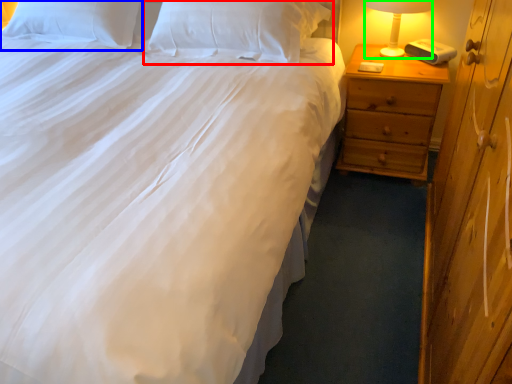
Question: Which object is the closest to the pillow (highlighted by a red box)? Choose among these: pillow (highlighted by a blue box) or bedside lamp (highlighted by a green box).

Choices:
 (A) pillow
 (B) bedside lamp

Answer: (A)